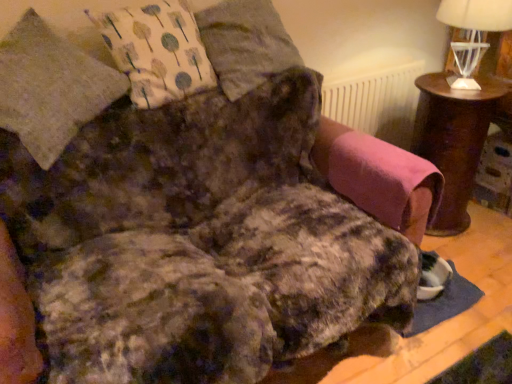
Question: From the image's perspective, is white textured radiator at upper center located beneath white glass table lamp at upper right?

Choices:
 (A) yes
 (B) no

Answer: (A)

Question: Is white textured radiator at upper center smaller than white glass table lamp at upper right?

Choices:
 (A) yes
 (B) no

Answer: (B)

Question: Considering the relative positions of white textured radiator at upper center and white glass table lamp at upper right in the image provided, is white textured radiator at upper center to the right of white glass table lamp at upper right from the viewer's perspective?

Choices:
 (A) yes
 (B) no

Answer: (B)

Question: Is white glass table lamp at upper right a part of white textured radiator at upper center?

Choices:
 (A) no
 (B) yes

Answer: (A)

Question: Considering the relative sizes of white textured radiator at upper center and white glass table lamp at upper right in the image provided, is white textured radiator at upper center thinner than white glass table lamp at upper right?

Choices:
 (A) yes
 (B) no

Answer: (A)

Question: From a real-world perspective, does white textured radiator at upper center sit lower than white glass table lamp at upper right?

Choices:
 (A) no
 (B) yes

Answer: (B)

Question: Is the depth of fluffy gray pillow at upper center, which is counted as the 2th pillow, starting from the left, greater than that of pink fabric swivel chair at right?

Choices:
 (A) yes
 (B) no

Answer: (A)

Question: Is fluffy gray pillow at upper center, which is counted as the 2th pillow, starting from the left, wider than pink fabric swivel chair at right?

Choices:
 (A) no
 (B) yes

Answer: (B)

Question: From a real-world perspective, is fluffy gray pillow at upper center, which is counted as the 2th pillow, starting from the left, positioned under pink fabric swivel chair at right based on gravity?

Choices:
 (A) no
 (B) yes

Answer: (A)

Question: Considering the relative sizes of fluffy gray pillow at upper center, which is counted as the 2th pillow, starting from the left, and pink fabric swivel chair at right in the image provided, is fluffy gray pillow at upper center, which is counted as the 2th pillow, starting from the left, taller than pink fabric swivel chair at right?

Choices:
 (A) yes
 (B) no

Answer: (A)

Question: Is fluffy gray pillow at upper center, which is counted as the 2th pillow, starting from the left, with pink fabric swivel chair at right?

Choices:
 (A) no
 (B) yes

Answer: (A)

Question: Could you tell me if fluffy gray pillow at upper center, which is counted as the 2th pillow, starting from the left, is facing pink fabric swivel chair at right?

Choices:
 (A) yes
 (B) no

Answer: (B)

Question: Is white glass table lamp at upper right inside brown wooden table at right?

Choices:
 (A) yes
 (B) no

Answer: (B)